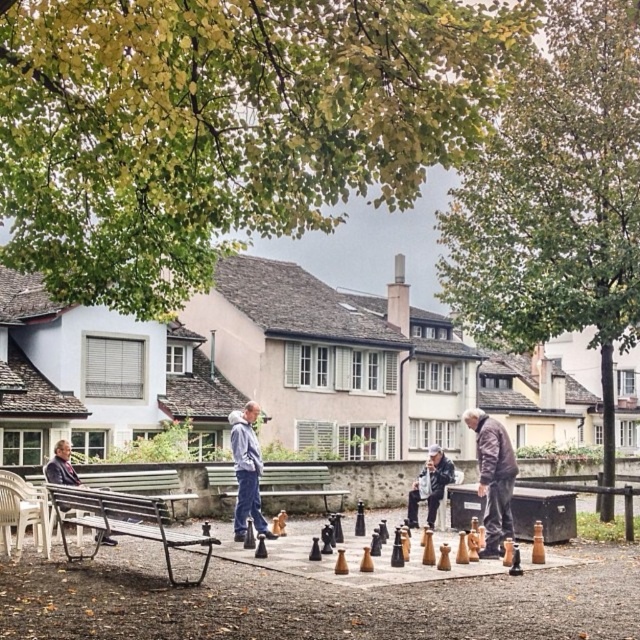
You are a photographer positioned at the edge of the chessboard. You want to take a photo that includes both the brown leather jacket at center and the white plastic bench at lower left. Which object will appear closer to the camera in the photo?

Result: The brown leather jacket at center will appear closer to the camera in the photo because it is further to the viewer than the white plastic bench at lower left, meaning it is positioned nearer to the photographer.

You are a photographer standing at the point marked as point (246,472) in the image. What color is the clothing item closest to you at that location?

The point (246,472) is on light blue denim pants at center, so the clothing item closest to you at that location is light blue denim pants.

You are planning to place a small potted plant between the white plastic bench at lower left and the dark gray fabric jacket at lower center. Which object should the plant be closer to if you want it to be as far as possible from the narrower object?

The white plastic bench at lower left is narrower than the dark gray fabric jacket at lower center. To place the plant as far as possible from the narrower object, position it closer to the white plastic bench at lower left so it is farther from the narrower bench.